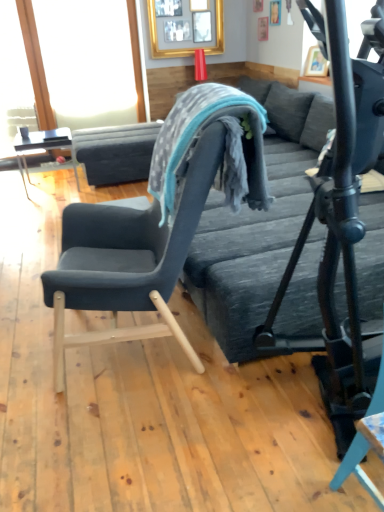
Question: Considering the relative sizes of gold-framed picture at upper center and transparent glass window screen at upper left in the image provided, is gold-framed picture at upper center wider than transparent glass window screen at upper left?

Choices:
 (A) yes
 (B) no

Answer: (A)

Question: Is gold-framed picture at upper center to the right of transparent glass window screen at upper left from the viewer's perspective?

Choices:
 (A) yes
 (B) no

Answer: (A)

Question: Can you confirm if gold-framed picture at upper center is smaller than transparent glass window screen at upper left?

Choices:
 (A) yes
 (B) no

Answer: (A)

Question: Is gold-framed picture at upper center closer to the viewer compared to transparent glass window screen at upper left?

Choices:
 (A) yes
 (B) no

Answer: (B)

Question: Does gold-framed picture at upper center appear on the left side of transparent glass window screen at upper left?

Choices:
 (A) yes
 (B) no

Answer: (B)

Question: From the image's perspective, is textured gray bean bag chair at center above or below velvet dark blue chair at left?

Choices:
 (A) above
 (B) below

Answer: (A)

Question: Relative to velvet dark blue chair at left, is textured gray bean bag chair at center in front or behind?

Choices:
 (A) behind
 (B) front

Answer: (A)

Question: Does point (157, 173) appear closer or farther from the camera than point (201, 118)?

Choices:
 (A) closer
 (B) farther

Answer: (B)

Question: Would you say textured gray bean bag chair at center is to the left or to the right of velvet dark blue chair at left in the picture?

Choices:
 (A) right
 (B) left

Answer: (A)

Question: From the image's perspective, relative to matte black table at left, is velvet dark blue chair at left above or below?

Choices:
 (A) below
 (B) above

Answer: (A)

Question: Considering the positions of velvet dark blue chair at left and matte black table at left in the image, is velvet dark blue chair at left taller or shorter than matte black table at left?

Choices:
 (A) tall
 (B) short

Answer: (A)

Question: Is point (187, 229) closer or farther from the camera than point (41, 145)?

Choices:
 (A) farther
 (B) closer

Answer: (B)

Question: From a real-world perspective, is velvet dark blue chair at left above or below matte black table at left?

Choices:
 (A) below
 (B) above

Answer: (B)

Question: Is matte black table at left inside or outside of textured gray bean bag chair at center?

Choices:
 (A) outside
 (B) inside

Answer: (A)

Question: In the image, is matte black table at left positioned in front of or behind textured gray bean bag chair at center?

Choices:
 (A) behind
 (B) front

Answer: (A)